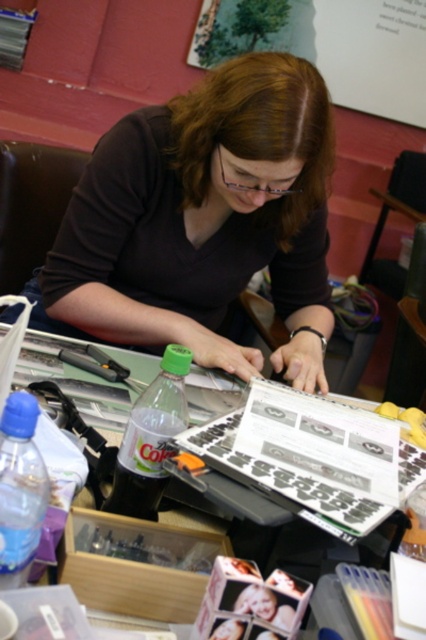
Question: Among these points, which one is nearest to the camera?

Choices:
 (A) (115, 132)
 (B) (287, 33)
 (C) (198, 438)
 (D) (11, 506)

Answer: (D)

Question: Does clear plastic table at center appear under blue plastic bottle at lower left?

Choices:
 (A) yes
 (B) no

Answer: (A)

Question: Is wooden bulletin board at upper center thinner than clear plastic bottle at center?

Choices:
 (A) no
 (B) yes

Answer: (A)

Question: Among these points, which one is nearest to the camera?

Choices:
 (A) (333, 408)
 (B) (20, 486)
 (C) (235, 362)

Answer: (B)

Question: Among these objects, which one is farthest from the camera?

Choices:
 (A) wooden bulletin board at upper center
 (B) clear plastic table at center

Answer: (A)

Question: Can you confirm if matte black shirt at center is positioned to the right of blue plastic bottle at lower left?

Choices:
 (A) yes
 (B) no

Answer: (A)